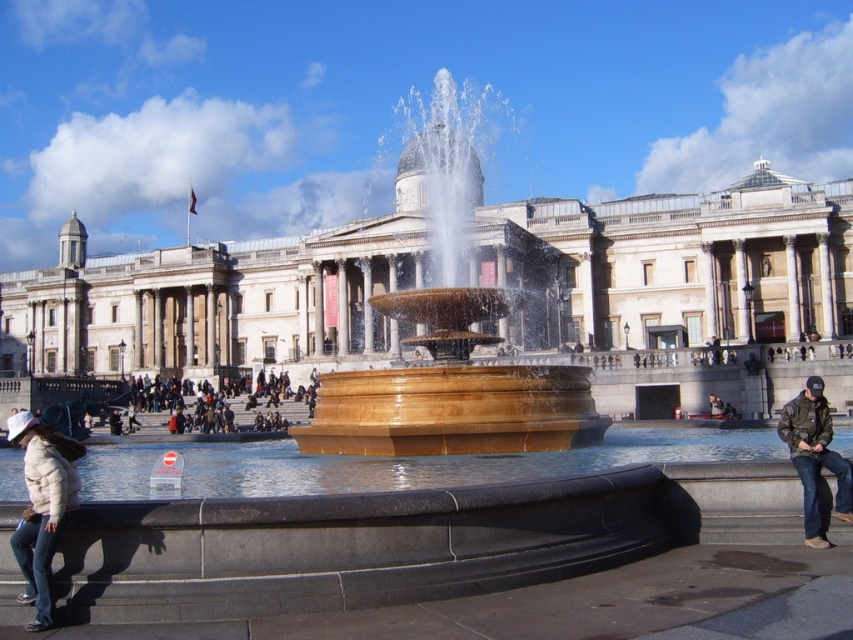
Question: Is golden stone fountain at center above white matte jacket at lower left?

Choices:
 (A) no
 (B) yes

Answer: (B)

Question: Which point is farther from the camera taking this photo?

Choices:
 (A) (838, 509)
 (B) (532, 262)

Answer: (B)

Question: Which point is closer to the camera taking this photo?

Choices:
 (A) (474, 332)
 (B) (24, 593)

Answer: (B)

Question: Based on their relative distances, which object is farther from the golden stone fountain at center?

Choices:
 (A) camouflage jacket at lower right
 (B) white matte jacket at lower left

Answer: (B)

Question: Can you confirm if white matte jacket at lower left is smaller than camouflage jacket at lower right?

Choices:
 (A) yes
 (B) no

Answer: (B)

Question: Can you confirm if marble building at center is thinner than camouflage jacket at lower right?

Choices:
 (A) yes
 (B) no

Answer: (B)